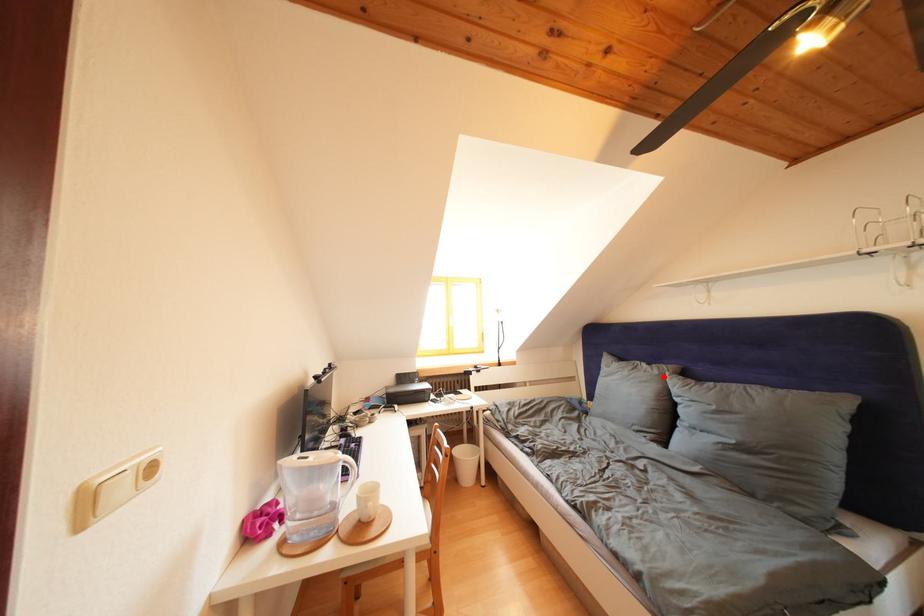
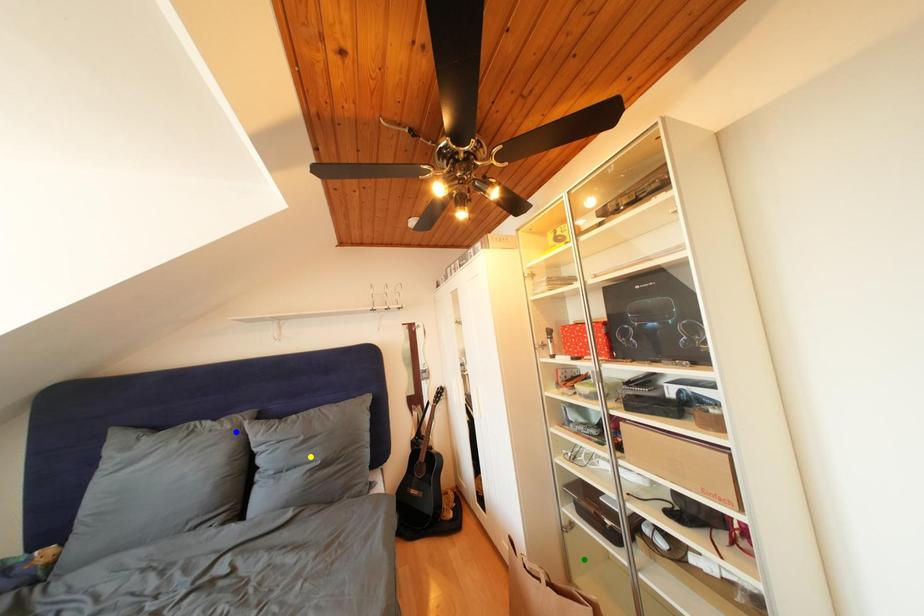
Question: I am providing you with two images of the same scene from different viewpoints. A red point is marked on the first image. You are given multiple points on the second image. Can you choose the point in image 2 that corresponds to the point in image 1?

Choices:
 (A) blue point
 (B) green point
 (C) yellow point

Answer: (A)